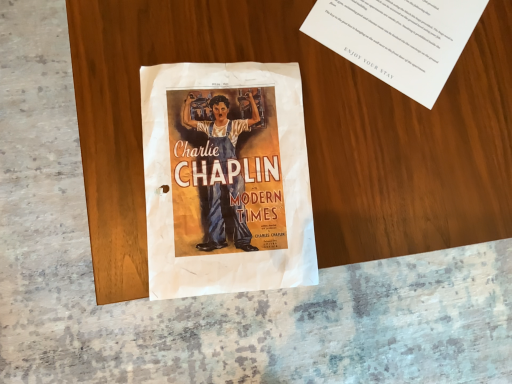
Image resolution: width=512 pixels, height=384 pixels. What do you see at coordinates (398, 38) in the screenshot? I see `white paper at upper right` at bounding box center [398, 38].

You are a GUI agent. You are given a task and a screenshot of the screen. Output one action in this format:
    pyautogui.click(x=<x>, y=<y>)
    Task: Click on the white paper at upper right
    The height and width of the screenshot is (384, 512).
    Given the screenshot: What is the action you would take?
    pyautogui.click(x=398, y=38)

What are the coordinates of `white paper at upper right` in the screenshot? It's located at (398, 38).